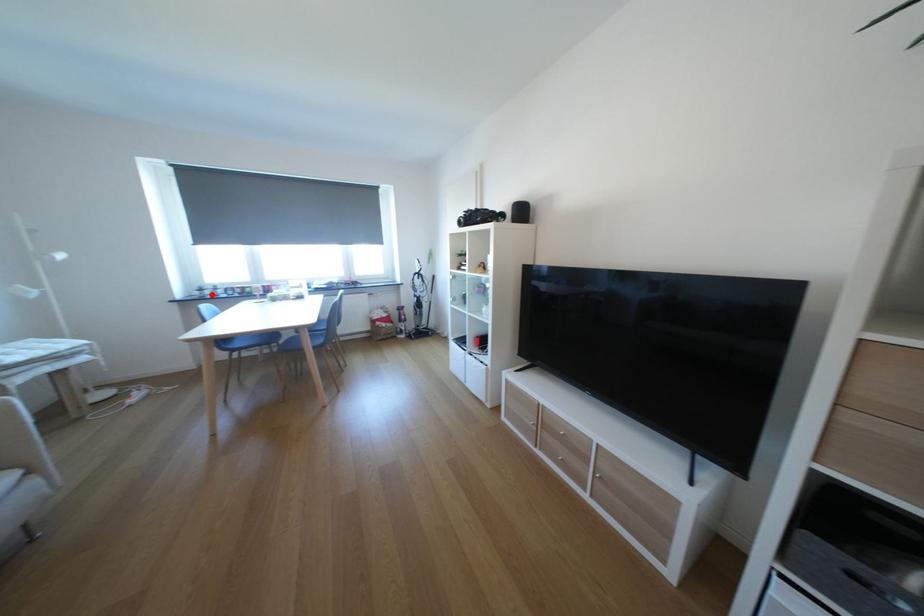
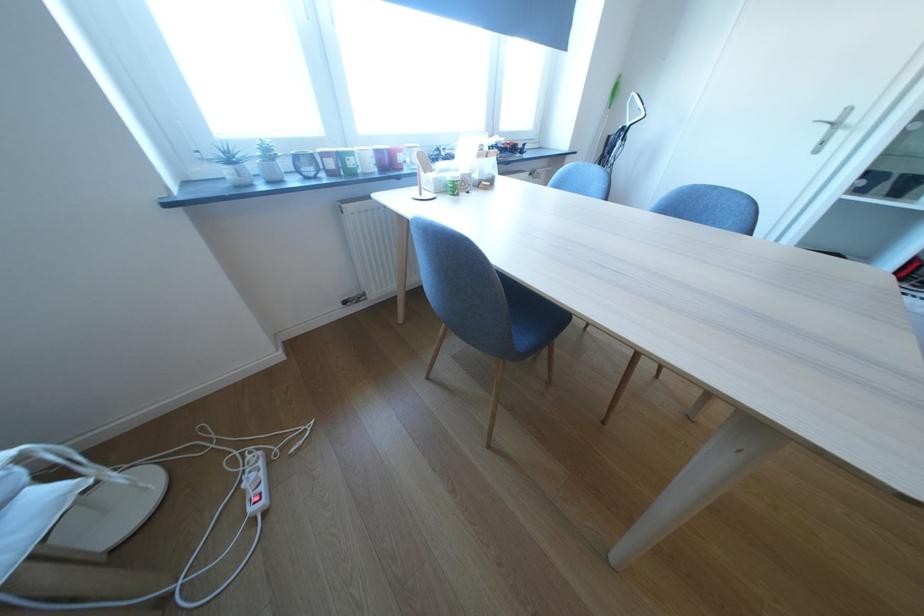
Where in the second image is the point corresponding to the highlighted location from the first image?

(249, 175)